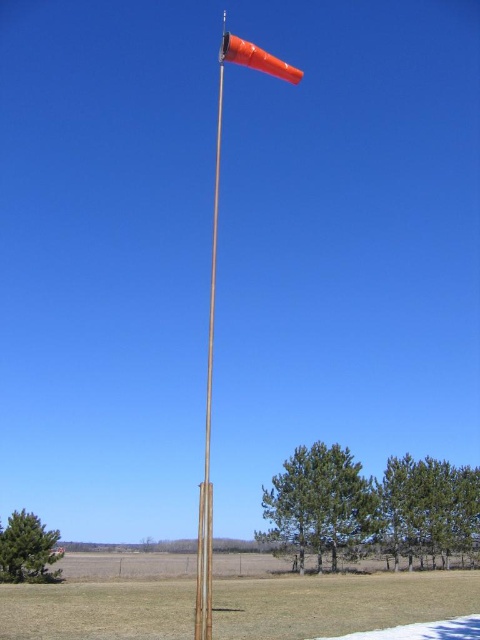
You are a bird perched on a tree branch observing the wooden flag pole at center and the orange matte windsock at upper center. Which object is taller?

The wooden flag pole at center is taller than the orange matte windsock at upper center.